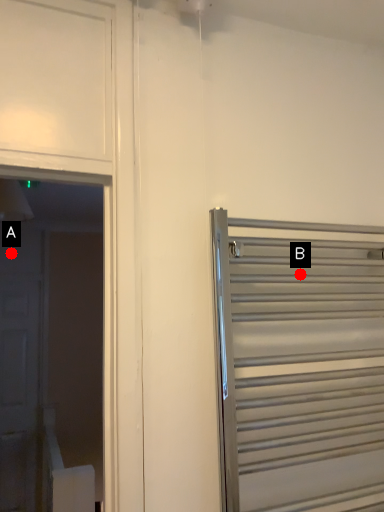
Question: Two points are circled on the image, labeled by A and B beside each circle. Which of the following is the farthest from the observer?

Choices:
 (A) A is further
 (B) B is further

Answer: (A)